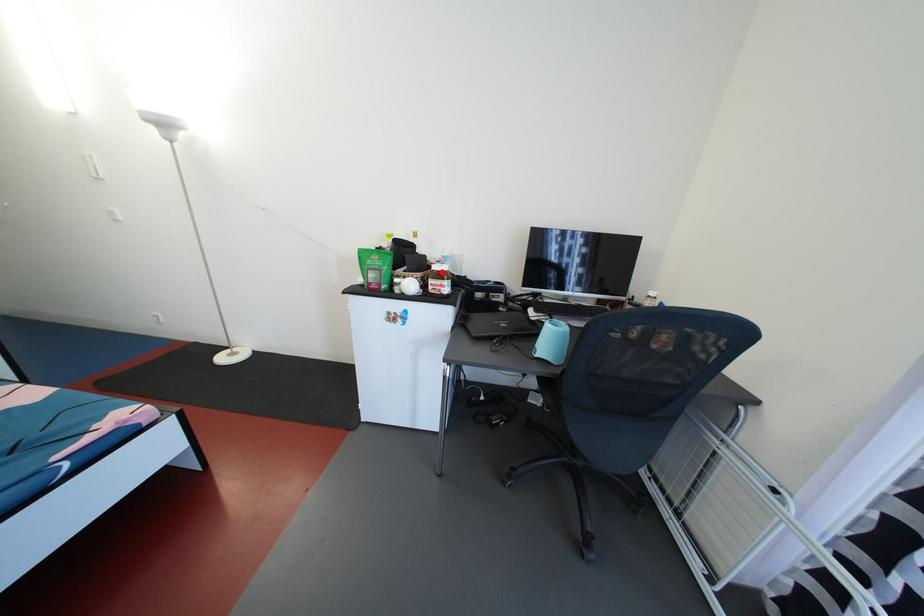
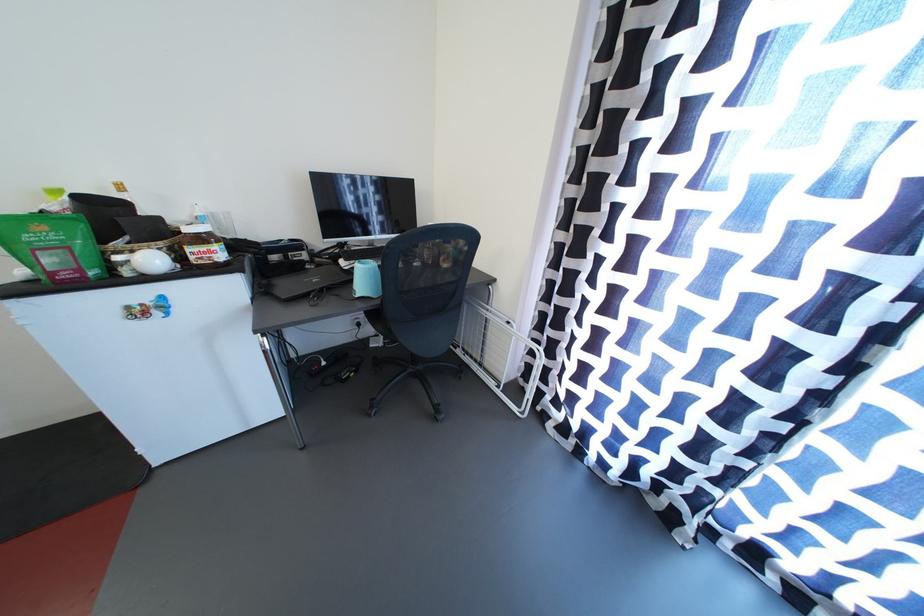
The point at the highlighted location is marked in the first image. Where is the corresponding point in the second image?

(195, 235)